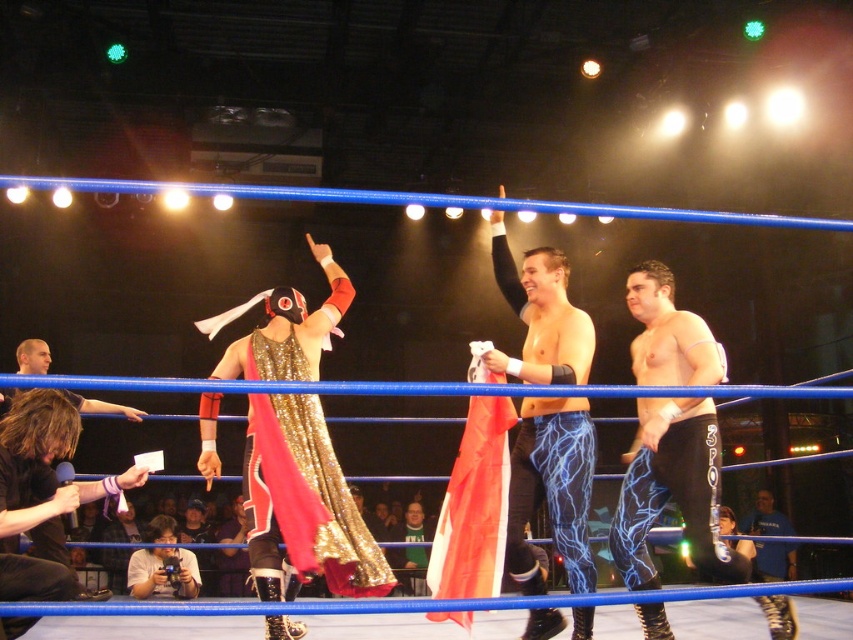
Question: Observing the image, what is the correct spatial positioning of black leather jacket at lower left in reference to matte black camera at lower left?

Choices:
 (A) above
 (B) below

Answer: (A)

Question: Which point is farther from the camera taking this photo?

Choices:
 (A) (1, 579)
 (B) (711, 356)

Answer: (B)

Question: Can you confirm if shiny gold cape at center is positioned to the left of black leather jacket at lower left?

Choices:
 (A) yes
 (B) no

Answer: (B)

Question: Does matte black camera at lower left have a lesser width compared to dark blue jersey at lower right?

Choices:
 (A) yes
 (B) no

Answer: (B)

Question: Which of the following is the farthest from the observer?

Choices:
 (A) (550, 336)
 (B) (138, 580)

Answer: (B)

Question: Among these objects, which one is nearest to the camera?

Choices:
 (A) shiny gold cape at center
 (B) dark blue jersey at lower right
 (C) shiny blue leggings at center

Answer: (C)